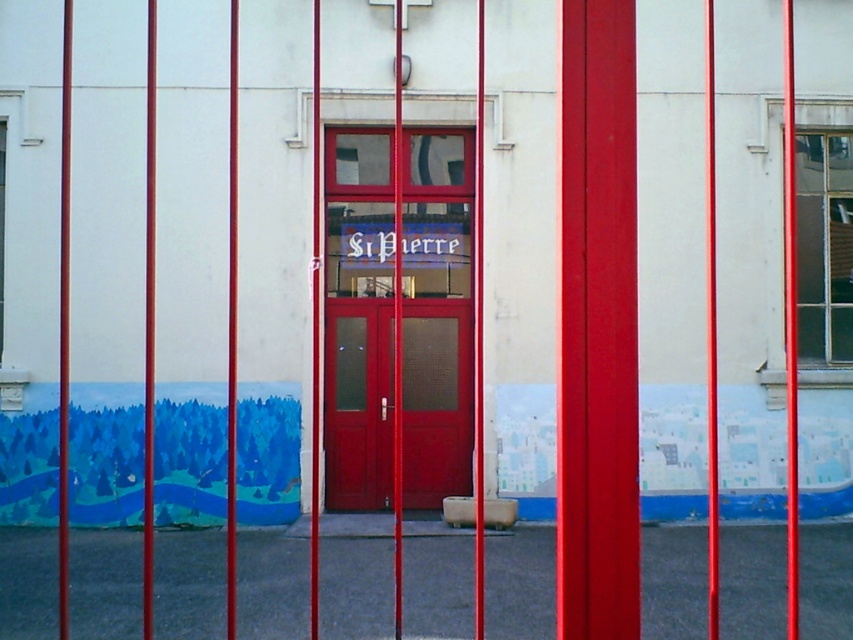
You are standing behind the red bars and looking at the scene. There are two points marked in the image. The first point is at coordinate point(349, 435) and the second point is at coordinate point(804, 145). Which point is closer to you?

Point(349, 435) is closer to you because it is in front of point(804, 145).

You are standing in front of a building and want to enter through the door. There is a clear glass window at upper right and a matte red door at center. Which object is higher up in the image?

The clear glass window at upper right is higher up in the image than the matte red door at center.